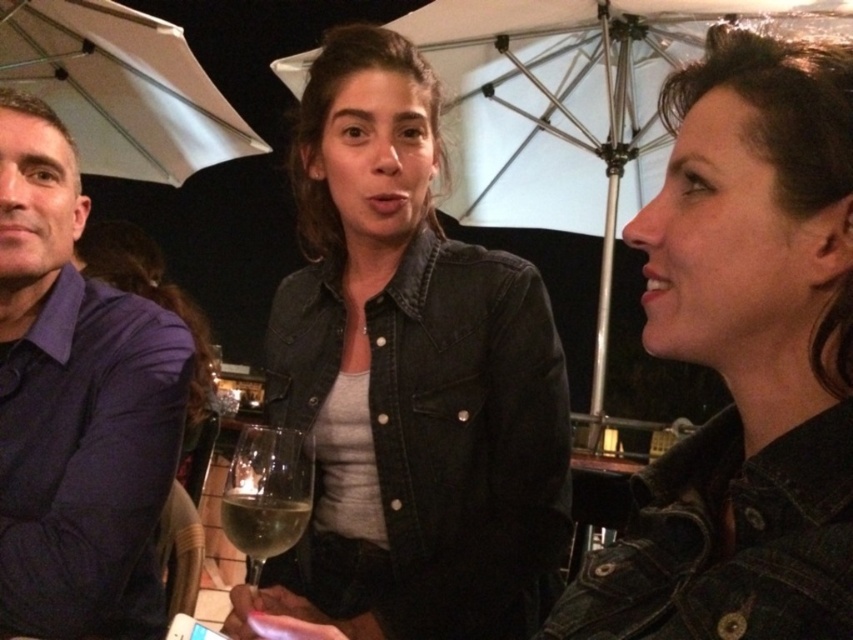
Measure the distance between denim jacket at upper right and white matte umbrella at upper left.

7.17 feet

Between point (802, 150) and point (134, 141), which one is positioned in front?

Point (802, 150)

Between point (775, 381) and point (223, 138), which one is positioned behind?

The point (223, 138) is behind.

You are a GUI agent. You are given a task and a screenshot of the screen. Output one action in this format:
    pyautogui.click(x=<x>, y=<y>)
    Task: Click on the denim jacket at upper right
    
    Given the screenshot: What is the action you would take?
    pyautogui.click(x=744, y=360)

Does denim jacket at center have a greater height compared to purple shirt at left?

Correct, denim jacket at center is much taller as purple shirt at left.

Is denim jacket at center thinner than purple shirt at left?

No.

Who is more forward, [541,310] or [44,396]?

Point [44,396] is more forward.

This screenshot has height=640, width=853. Identify the location of denim jacket at center. (408, 380).

Between denim jacket at center and denim jacket at upper right, which one appears on the left side from the viewer's perspective?

denim jacket at center is more to the left.

Which is behind, point (390, 284) or point (749, 312)?

The point (390, 284) is more distant.

Which is behind, point (527, 278) or point (782, 499)?

The point (527, 278) is behind.

Locate an element on the screen. denim jacket at center is located at coordinates (408, 380).